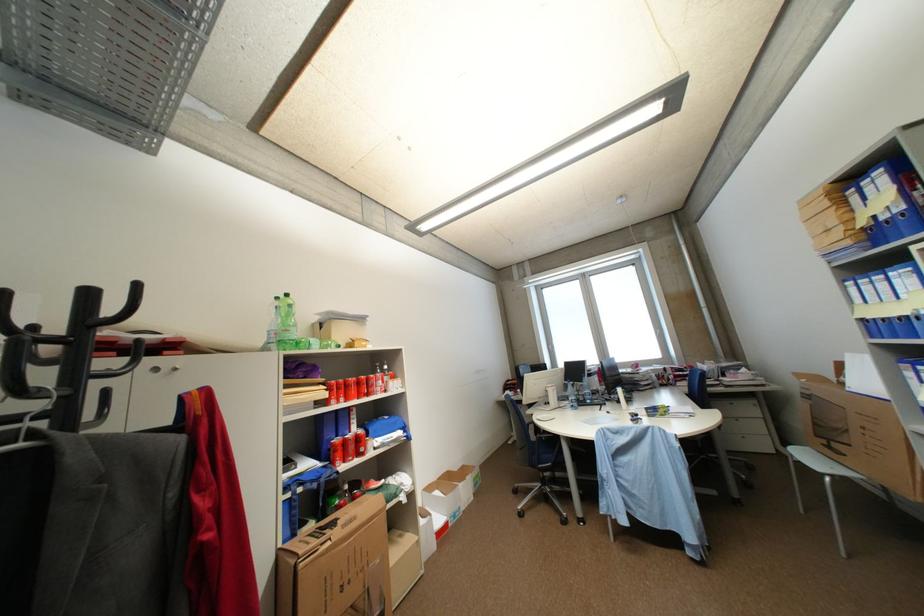
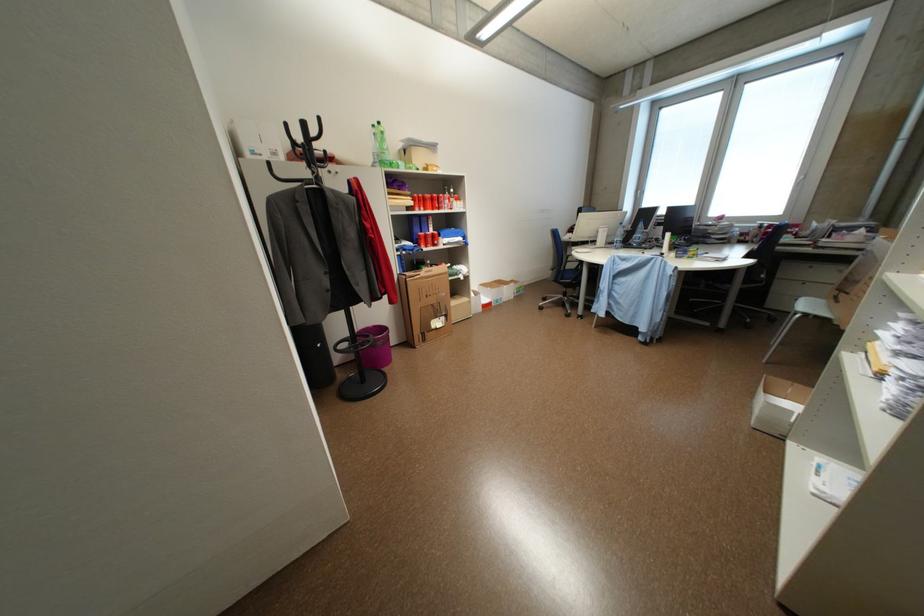
Find the pixel in the second image that matches (286,300) in the first image.

(382, 127)